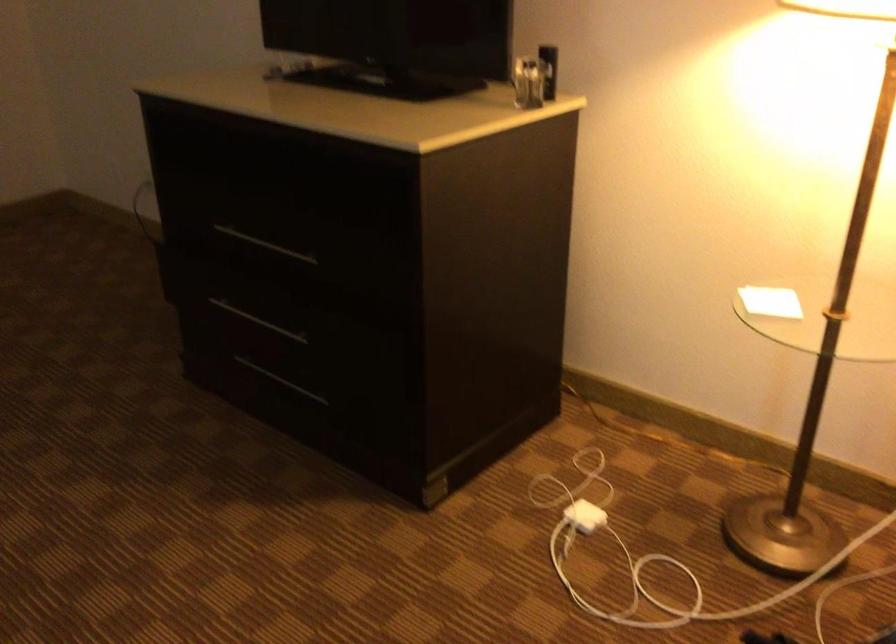
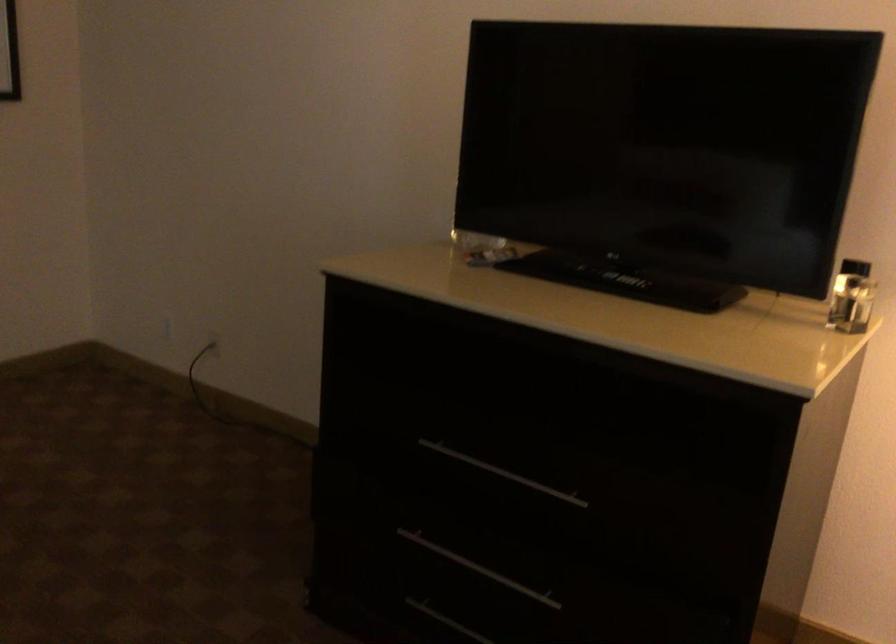
Locate, in the second image, the point that corresponds to (x=255, y=368) in the first image.

(446, 621)